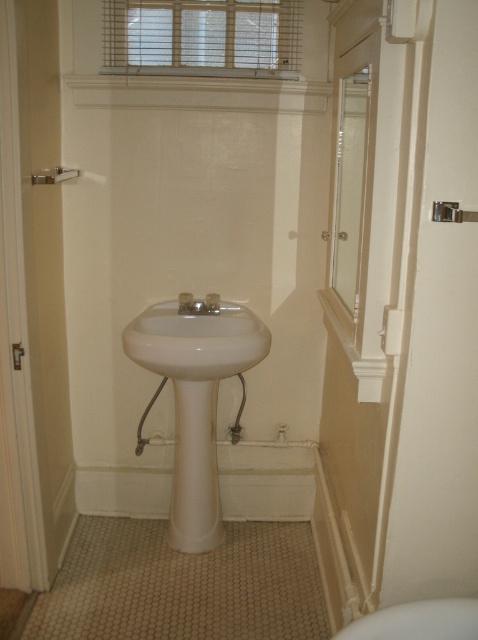
Consider the image. You are a contractor measuring bathroom fixtures. You need to install a new cabinet that must be shorter than both the white glossy pedestal sink at center and the white glossy toilet bowl at lower right. Which fixture determines the maximum height your cabinet can be?

The white glossy toilet bowl at lower right determines the maximum height because it is shorter than the white glossy pedestal sink at center.

You are designing a bathroom layout and need to ensure that the brushed metal shower at upper left and the matte silver faucet at center are spaced appropriately. Based on their sizes, which object requires more space in the layout?

Result: The brushed metal shower at upper left requires more space in the layout because it is bigger than the matte silver faucet at center.